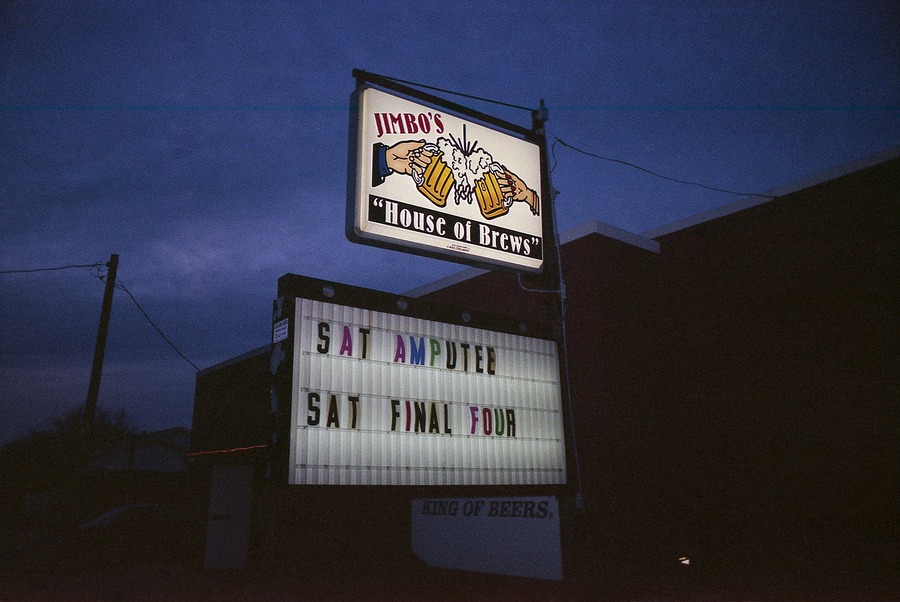
Image resolution: width=900 pixels, height=602 pixels. I want to click on bar sign- jimbos house of brews, so click(429, 185).